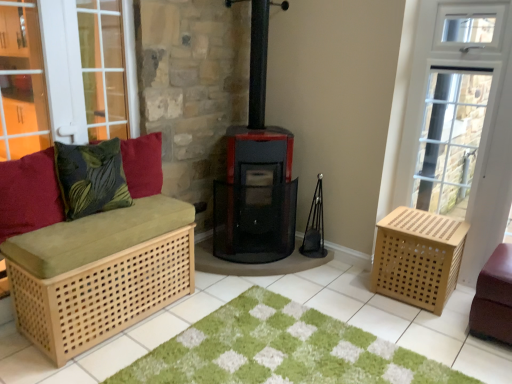
Question: Should I look upward or downward to see wooden crate at right?

Choices:
 (A) down
 (B) up

Answer: (B)

Question: Considering the relative positions of green leafy fabric pillow at left, which is the 2th pillow from left to right, and natural wood crate at right in the image provided, is green leafy fabric pillow at left, which is the 2th pillow from left to right, in front of natural wood crate at right?

Choices:
 (A) yes
 (B) no

Answer: (A)

Question: Is green leafy fabric pillow at left, placed as the 2th pillow when sorted from right to left, completely or partially outside of natural wood crate at right?

Choices:
 (A) no
 (B) yes

Answer: (B)

Question: From the image's perspective, is green leafy fabric pillow at left, placed as the 2th pillow when sorted from right to left, over natural wood crate at right?

Choices:
 (A) no
 (B) yes

Answer: (B)

Question: Is green leafy fabric pillow at left, which is the 2th pillow from left to right, to the left of natural wood crate at right from the viewer's perspective?

Choices:
 (A) no
 (B) yes

Answer: (B)

Question: Are green leafy fabric pillow at left, which is the 2th pillow from left to right, and natural wood crate at right beside each other?

Choices:
 (A) no
 (B) yes

Answer: (A)

Question: Is green leafy fabric pillow at left, which is the 2th pillow from left to right, thinner than natural wood crate at right?

Choices:
 (A) yes
 (B) no

Answer: (A)

Question: From a real-world perspective, is velvet red cushion at left, arranged as the 3th pillow when viewed from the right, physically above natural wood crate at right?

Choices:
 (A) no
 (B) yes

Answer: (B)

Question: Could natural wood crate at right be considered to be inside velvet red cushion at left, arranged as the 3th pillow when viewed from the right?

Choices:
 (A) yes
 (B) no

Answer: (B)

Question: Is the position of velvet red cushion at left, which is counted as the 1th pillow, starting from the left, more distant than that of natural wood crate at right?

Choices:
 (A) yes
 (B) no

Answer: (B)

Question: Would you consider velvet red cushion at left, which is counted as the 1th pillow, starting from the left, to be distant from natural wood crate at right?

Choices:
 (A) yes
 (B) no

Answer: (A)

Question: Is velvet red cushion at left, which is counted as the 1th pillow, starting from the left, at the left side of natural wood crate at right?

Choices:
 (A) yes
 (B) no

Answer: (A)

Question: Can you confirm if velvet red cushion at left, which is counted as the 1th pillow, starting from the left, is bigger than natural wood crate at right?

Choices:
 (A) yes
 (B) no

Answer: (B)

Question: Would you consider green shaggy rug at center to be distant from velvety green pillow at left, marked as the 1th pillow in a right-to-left arrangement?

Choices:
 (A) yes
 (B) no

Answer: (A)